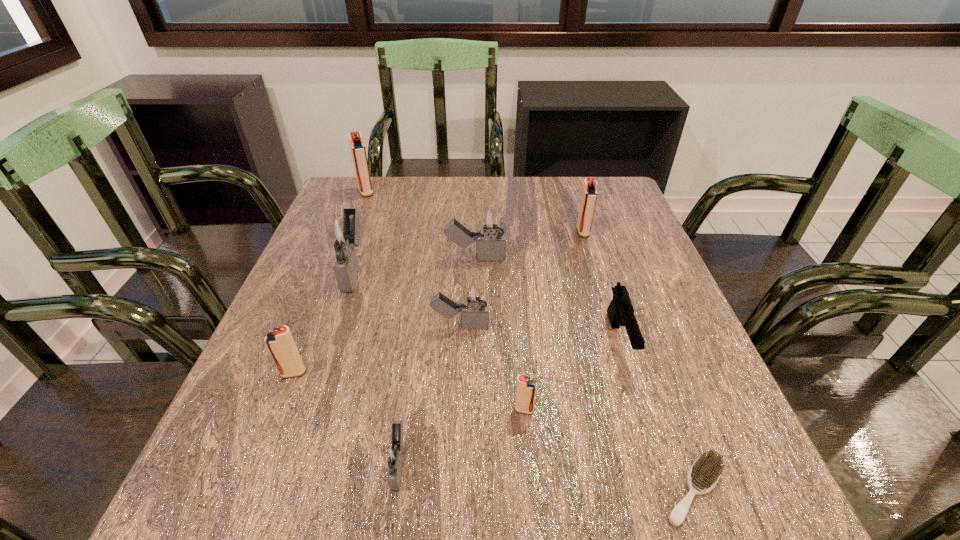
This screenshot has width=960, height=540. What are the coordinates of `pistol` in the screenshot? It's located at (620, 311).

Where is `the smallest red igniter`? This screenshot has height=540, width=960. the smallest red igniter is located at coordinates (526, 388).

This screenshot has height=540, width=960. Identify the location of the second red igniter from right to left. (526, 388).

Find the location of a particular element. the smallest gray igniter is located at coordinates [395, 456].

The width and height of the screenshot is (960, 540). I want to click on the fourth igniter from left to right, so [395, 456].

Find the location of a particular element. scrubbing brush is located at coordinates (705, 472).

Locate an element on the screen. This screenshot has height=540, width=960. free space located on the front of the farthest object is located at coordinates (347, 242).

Locate an element on the screen. This screenshot has height=540, width=960. free space located on the front of the leftmost gray igniter is located at coordinates (288, 471).

Where is `free region located on the back of the second biggest red igniter`? The image size is (960, 540). free region located on the back of the second biggest red igniter is located at coordinates [x=566, y=178].

Where is `free region located on the front of the third smallest gray igniter`? free region located on the front of the third smallest gray igniter is located at coordinates (474, 328).